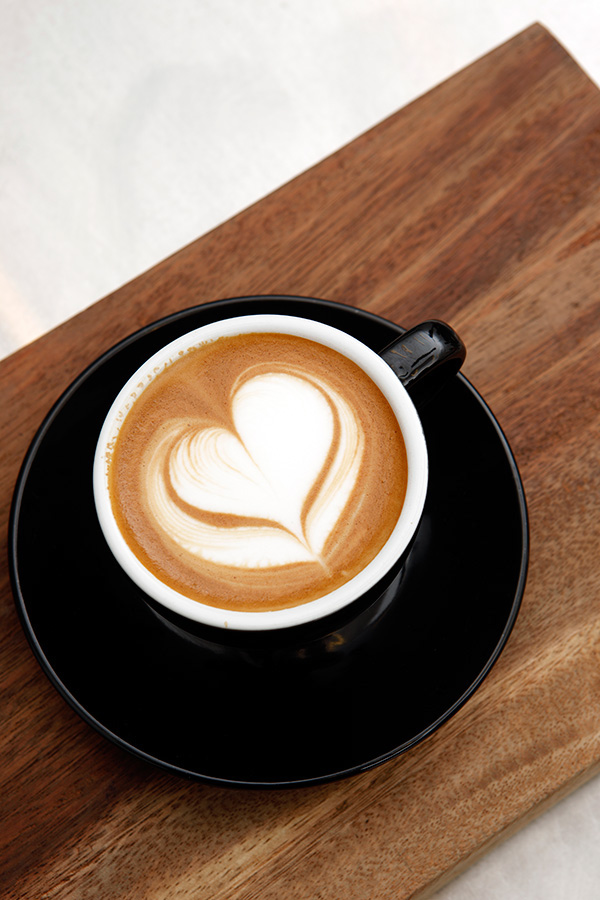
Identify the location of coffee cup. (371, 599).